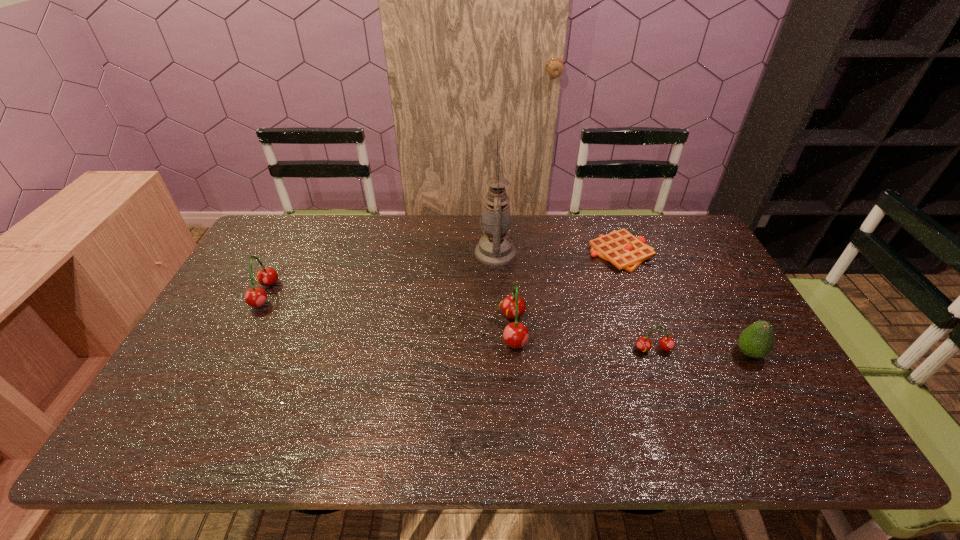
This screenshot has height=540, width=960. I want to click on free space located with stems pointing upwards on the second cherry from right to left, so click(x=397, y=329).

This screenshot has height=540, width=960. Identify the location of free space located 0.330m with stems pointing upwards on the second cherry from right to left. (380, 329).

What are the coordinates of `vacant space situated 0.180m with stems pointing upwards on the second cherry from right to left` in the screenshot? It's located at (434, 329).

Where is `free space located with stems pointing upwards on the shortest cherry`? This screenshot has height=540, width=960. free space located with stems pointing upwards on the shortest cherry is located at coordinates (669, 393).

You are a GUI agent. You are given a task and a screenshot of the screen. Output one action in this format:
    pyautogui.click(x=<x>, y=<y>)
    Task: Click on the vacant space located on the left of the oil lamp
    Image resolution: width=960 pixels, height=540 pixels.
    Given the screenshot: What is the action you would take?
    pyautogui.click(x=420, y=253)

Find the location of a particular element. free location located 0.270m on the front of the shortest object is located at coordinates (655, 340).

Locate an element on the screen. The height and width of the screenshot is (540, 960). free region located 0.240m on the back of the fourth tallest object is located at coordinates (708, 282).

You are a GUI agent. You are given a task and a screenshot of the screen. Output one action in this format:
    pyautogui.click(x=<x>, y=<y>)
    Task: Click on the oil lamp situated at the far edge
    The image size is (960, 540).
    Given the screenshot: What is the action you would take?
    pyautogui.click(x=495, y=248)

Where is `waffle that is at the far edge`? The width and height of the screenshot is (960, 540). waffle that is at the far edge is located at coordinates (625, 251).

Find the location of `object that is at the left edge`. object that is at the left edge is located at coordinates (255, 297).